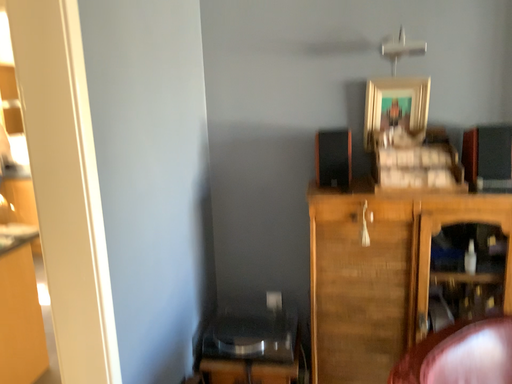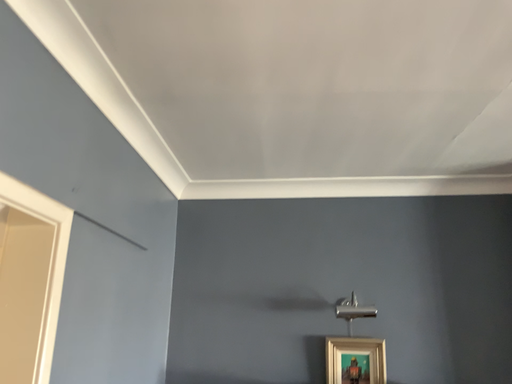
Question: How did the camera likely rotate when shooting the video?

Choices:
 (A) rotated downward
 (B) rotated upward

Answer: (B)